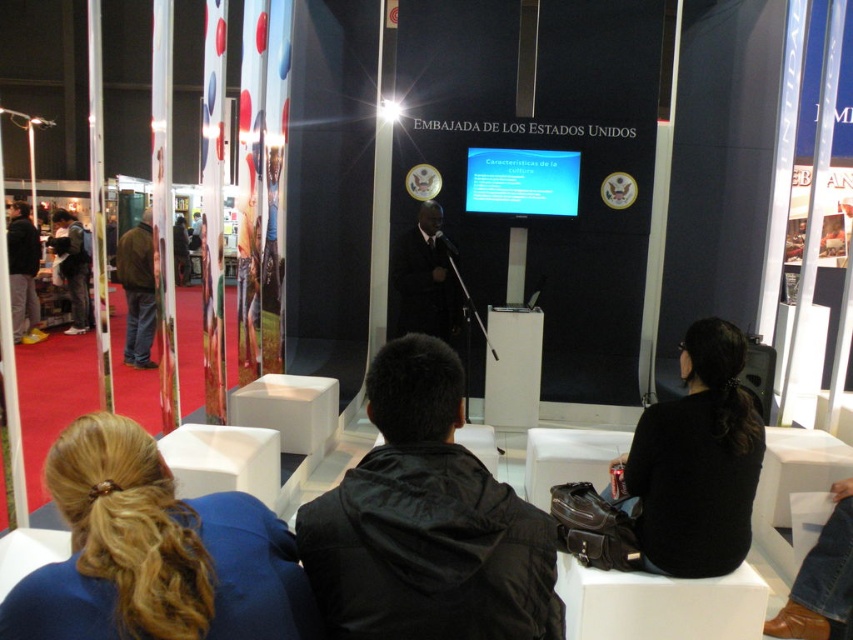
Can you confirm if blonde hair at lower left is positioned to the left of dark blue jacket at left?

In fact, blonde hair at lower left is to the right of dark blue jacket at left.

Does blonde hair at lower left have a greater height compared to dark blue jacket at left?

In fact, blonde hair at lower left may be shorter than dark blue jacket at left.

Which is in front, point (61, 461) or point (61, 212)?

Point (61, 461)

You are a GUI agent. You are given a task and a screenshot of the screen. Output one action in this format:
    pyautogui.click(x=<x>, y=<y>)
    Task: Click on the blonde hair at lower left
    Image resolution: width=853 pixels, height=640 pixels.
    Given the screenshot: What is the action you would take?
    pyautogui.click(x=155, y=552)

Can you confirm if matte blue screen at center is positioned above brown leather jacket at left?

Indeed, matte blue screen at center is positioned over brown leather jacket at left.

Who is shorter, matte blue screen at center or brown leather jacket at left?

With less height is matte blue screen at center.

Locate an element on the screen. This screenshot has height=640, width=853. matte blue screen at center is located at coordinates (521, 180).

I want to click on matte blue screen at center, so click(521, 180).

Does blonde hair at lower left appear on the left side of black matte sweater at lower right?

Yes, blonde hair at lower left is to the left of black matte sweater at lower right.

Is blonde hair at lower left bigger than black matte sweater at lower right?

No.

Where is `blonde hair at lower left`? blonde hair at lower left is located at coordinates (155, 552).

Locate an element on the screen. blonde hair at lower left is located at coordinates (155, 552).